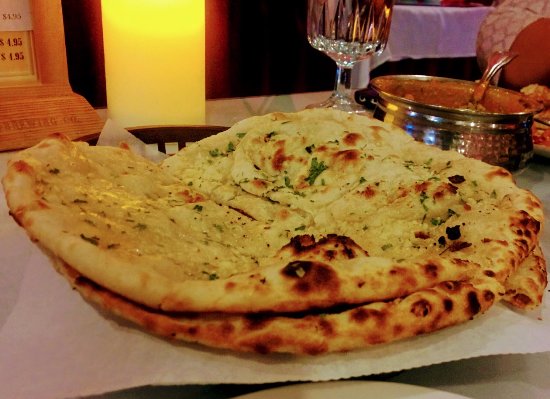
At what (x,y) coordinates should I click in order to perform the action: click on table. Please return your answer as a coordinate pair (x, y). Looking at the image, I should click on (492, 377).